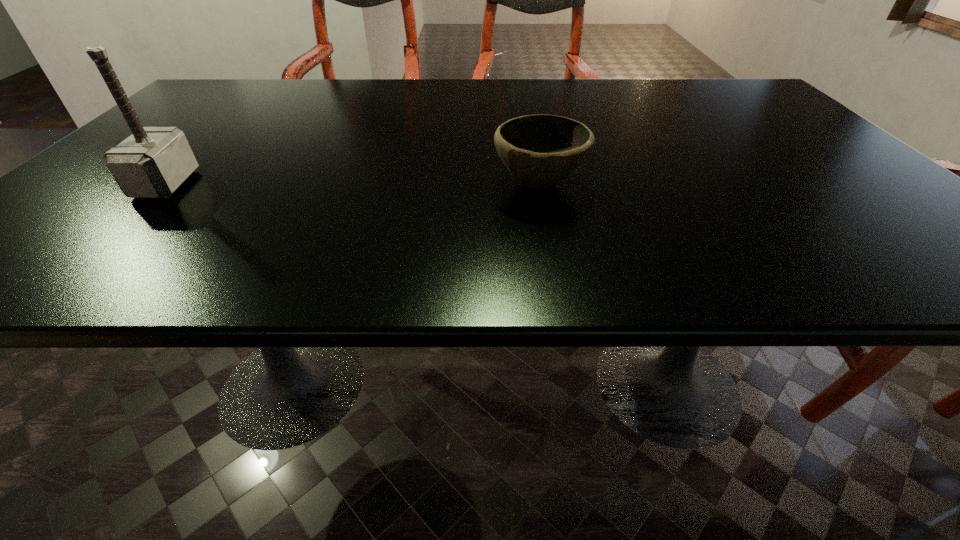
The image size is (960, 540). Identify the location of vacant space at the right edge of the desktop. (773, 130).

Image resolution: width=960 pixels, height=540 pixels. I want to click on free space at the far left corner, so click(x=225, y=87).

Identify the location of free spot at the near left corner of the desktop. (12, 269).

In the image, there is a desktop. Where is `vacant space at the far right corner`? The image size is (960, 540). vacant space at the far right corner is located at coordinates (769, 103).

What are the coordinates of `blank area in the image that satisfies the following two spatial constraints: 1. for striking with the head of the left object; 2. on the left side of the shorter object` in the screenshot? It's located at (166, 184).

Where is `vacant space that satisfies the following two spatial constraints: 1. for striking with the head of the hammer; 2. on the back side of the right object`? The image size is (960, 540). vacant space that satisfies the following two spatial constraints: 1. for striking with the head of the hammer; 2. on the back side of the right object is located at coordinates pos(166,184).

At what (x,y) coordinates should I click in order to perform the action: click on free space that satisfies the following two spatial constraints: 1. for striking with the head of the taller object; 2. on the left side of the bowl. Please return your answer as a coordinate pair (x, y). Looking at the image, I should click on (166, 184).

Locate an element on the screen. The width and height of the screenshot is (960, 540). free region that satisfies the following two spatial constraints: 1. for striking with the head of the right object; 2. on the right side of the left object is located at coordinates (166, 184).

You are a GUI agent. You are given a task and a screenshot of the screen. Output one action in this format:
    pyautogui.click(x=<x>, y=<y>)
    Task: Click on the vacant point that satisfies the following two spatial constraints: 1. for striking with the head of the bowl; 2. on the right side of the taller object
    The image size is (960, 540).
    Given the screenshot: What is the action you would take?
    pyautogui.click(x=166, y=184)

Find the location of a particular element. The height and width of the screenshot is (540, 960). free location that satisfies the following two spatial constraints: 1. on the back side of the right object; 2. for striking with the head of the hammer is located at coordinates (540, 184).